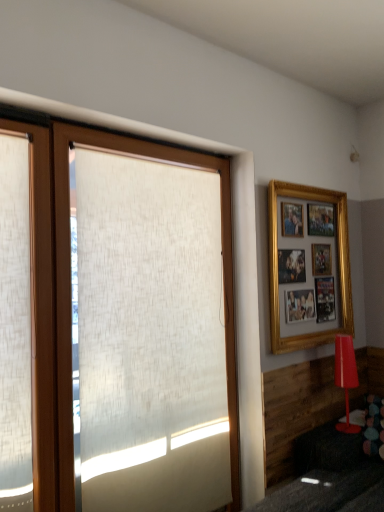
Question: Should I look upward or downward to see gold/gilded picture frame at upper right?

Choices:
 (A) down
 (B) up

Answer: (A)

Question: Can you confirm if matte red lamp at lower right is shorter than white textured roller blind at left?

Choices:
 (A) no
 (B) yes

Answer: (B)

Question: Can you see matte red lamp at lower right touching white textured roller blind at left?

Choices:
 (A) no
 (B) yes

Answer: (A)

Question: Is matte red lamp at lower right at the left side of white textured roller blind at left?

Choices:
 (A) no
 (B) yes

Answer: (A)

Question: Considering the relative positions of matte red lamp at lower right and white textured roller blind at left in the image provided, is matte red lamp at lower right in front of white textured roller blind at left?

Choices:
 (A) yes
 (B) no

Answer: (B)

Question: From a real-world perspective, is matte red lamp at lower right physically below white textured roller blind at left?

Choices:
 (A) no
 (B) yes

Answer: (B)

Question: Is matte red lamp at lower right turned away from white textured roller blind at left?

Choices:
 (A) yes
 (B) no

Answer: (B)

Question: Considering the relative sizes of white textured roller blind at left and matte red lamp at lower right in the image provided, is white textured roller blind at left taller than matte red lamp at lower right?

Choices:
 (A) yes
 (B) no

Answer: (A)

Question: Can you confirm if white textured roller blind at left is bigger than matte red lamp at lower right?

Choices:
 (A) yes
 (B) no

Answer: (A)

Question: Does white textured roller blind at left lie behind matte red lamp at lower right?

Choices:
 (A) no
 (B) yes

Answer: (A)

Question: Is matte red lamp at lower right inside white textured roller blind at left?

Choices:
 (A) no
 (B) yes

Answer: (A)

Question: Can we say white textured roller blind at left lies outside matte red lamp at lower right?

Choices:
 (A) no
 (B) yes

Answer: (B)

Question: Is white textured roller blind at left wider than matte red lamp at lower right?

Choices:
 (A) no
 (B) yes

Answer: (A)

Question: From the image's perspective, is white textured roller blind at left on top of wooden shutter at left?

Choices:
 (A) no
 (B) yes

Answer: (A)